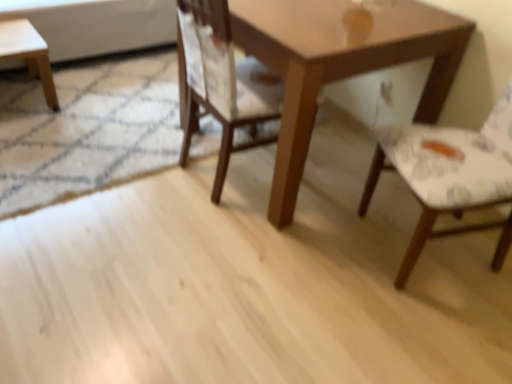
Identify the location of free space that is to the left of white fabric chair at right, which appears as the first chair when viewed from the right. This screenshot has width=512, height=384. (318, 255).